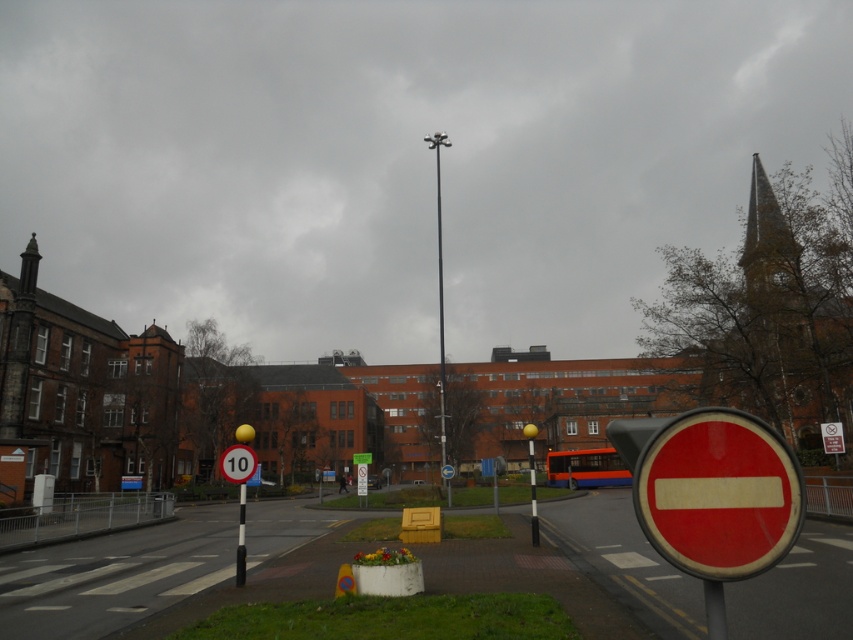
You are a pedestrian looking at the scene. You see a metallic pole at center and a black metal pole at center. Which pole is closer to you?

The metallic pole at center is closer to you because the black metal pole at center is behind it.